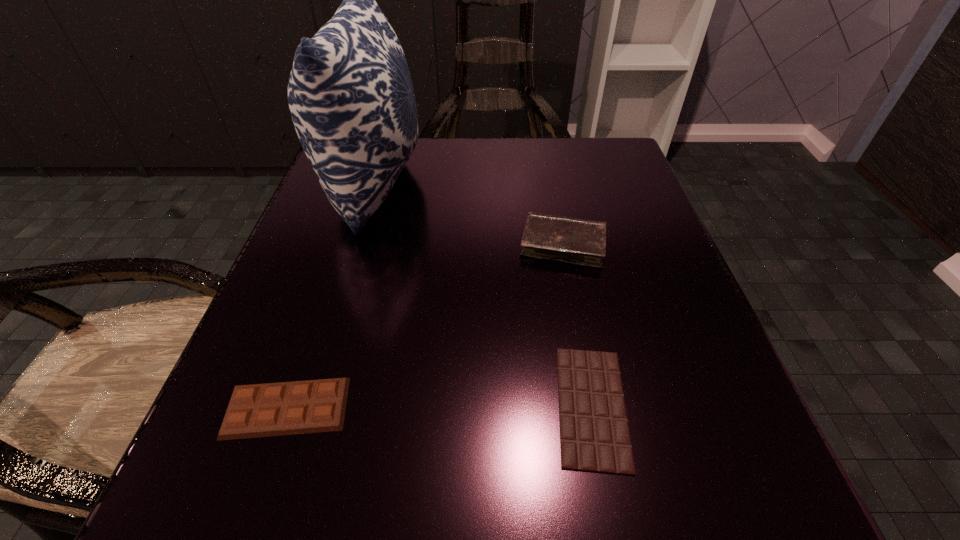
Where is `free space at the left edge of the desktop`? Image resolution: width=960 pixels, height=540 pixels. free space at the left edge of the desktop is located at coordinates (320, 244).

This screenshot has width=960, height=540. Find the location of `vacant space at the right edge of the desktop`. vacant space at the right edge of the desktop is located at coordinates [x=718, y=399].

Locate an element on the screen. vacant space at the near left corner of the desktop is located at coordinates (252, 481).

The width and height of the screenshot is (960, 540). Identify the location of free space at the far right corner of the desktop. (626, 177).

This screenshot has width=960, height=540. In order to click on vacant area between the cushion and the right chocolate bar in this screenshot , I will do `click(483, 294)`.

Where is `unoccupied position between the third tallest object and the shortest object`? The height and width of the screenshot is (540, 960). unoccupied position between the third tallest object and the shortest object is located at coordinates (440, 407).

The height and width of the screenshot is (540, 960). I want to click on vacant region between the third tallest object and the cushion, so click(x=331, y=295).

Where is `vacant point located between the tallest object and the diary`? vacant point located between the tallest object and the diary is located at coordinates pos(468,214).

Find the location of a particular element. This screenshot has height=540, width=960. vacant space that's between the shorter chocolate bar and the tallest object is located at coordinates (483, 294).

Locate an element on the screen. Image resolution: width=960 pixels, height=540 pixels. vacant space in between the left chocolate bar and the shorter chocolate bar is located at coordinates (440, 407).